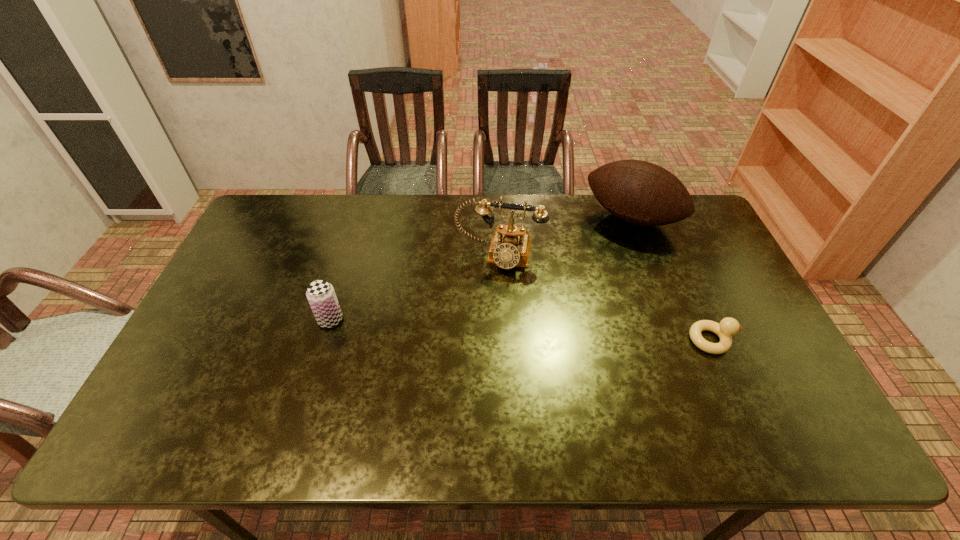
Image resolution: width=960 pixels, height=540 pixels. I want to click on free space located 0.140m on the laces of the football, so click(598, 261).

Find the location of a particular element. This screenshot has height=540, width=960. free space located on the laces of the football is located at coordinates (580, 289).

This screenshot has width=960, height=540. I want to click on vacant position located 0.270m on the laces of the football, so click(x=582, y=287).

I want to click on object that is at the far edge, so click(x=639, y=192).

Find the location of a particular element. The width and height of the screenshot is (960, 540). duckling present at the right edge is located at coordinates 728,326.

The height and width of the screenshot is (540, 960). I want to click on football that is at the right edge, so click(x=639, y=192).

I want to click on object at the far right corner, so click(639, 192).

Locate an element on the screen. Image resolution: width=960 pixels, height=540 pixels. free spot at the far edge of the desktop is located at coordinates (340, 226).

Locate an element on the screen. The width and height of the screenshot is (960, 540). free region at the near edge is located at coordinates (703, 402).

Locate an element on the screen. vacant space at the left edge of the desktop is located at coordinates (248, 315).